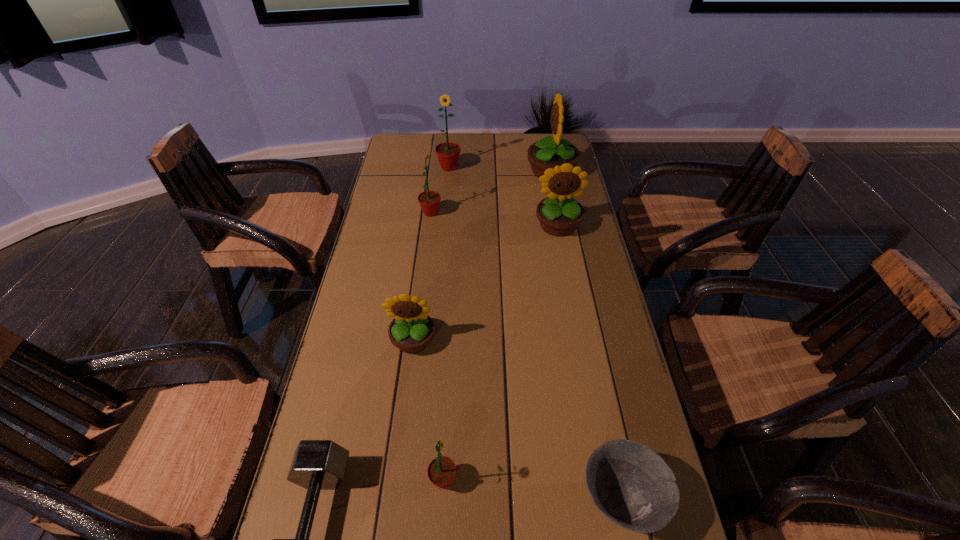
Where is `sunflower that is the third closest one to the second biggest green sunflower`? This screenshot has height=540, width=960. sunflower that is the third closest one to the second biggest green sunflower is located at coordinates (548, 152).

Locate an element on the screen. The height and width of the screenshot is (540, 960). sunflower that is the third nearest to the second farthest green sunflower is located at coordinates (548, 152).

Locate which yellow sunflower is the closest to the biggest yellow sunflower. Please provide its 2D coordinates. Your answer should be formatted as a tuple, i.e. [(x, y)], where the tuple contains the x and y coordinates of a point satisfying the conditions above.

[(560, 214)]

Identify which yellow sunflower is located as the second nearest to the second biggest green sunflower. Please provide its 2D coordinates. Your answer should be formatted as a tuple, i.e. [(x, y)], where the tuple contains the x and y coordinates of a point satisfying the conditions above.

[(548, 152)]

Identify the location of green sunflower that is the second closest one to the biggest green sunflower. (441, 471).

Find the location of a particular element. The image size is (960, 540). the second closest green sunflower relative to the smallest green sunflower is located at coordinates (448, 153).